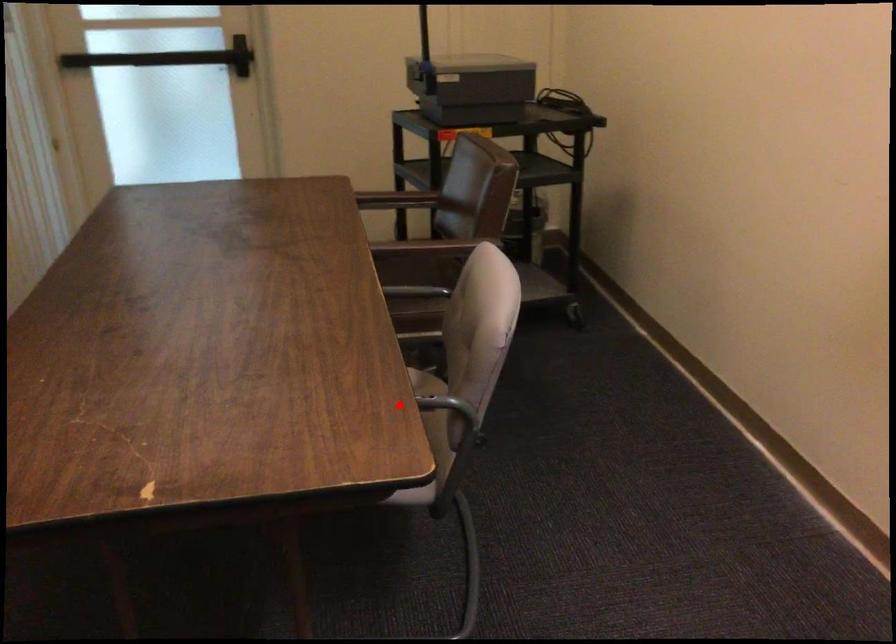
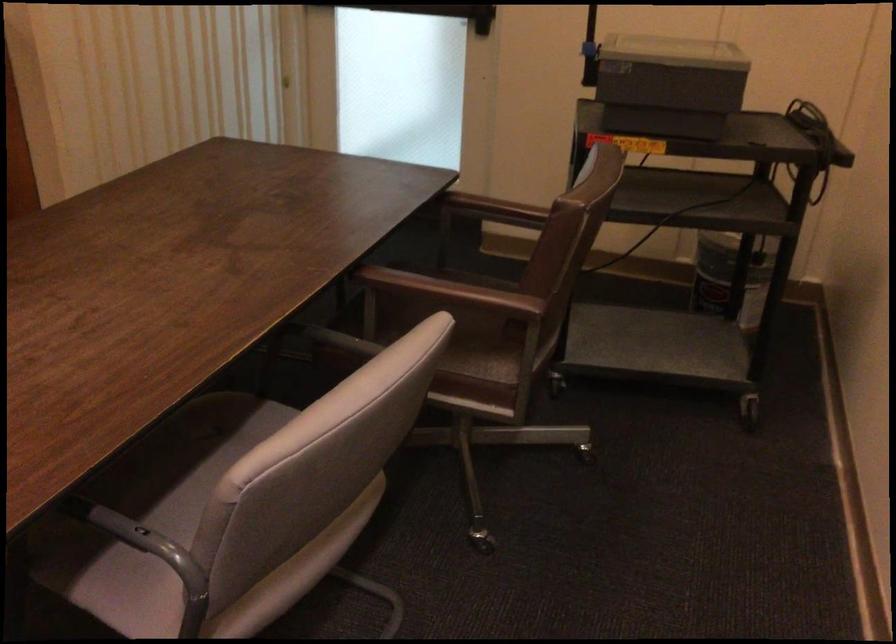
Question: A red point is marked in image1. In image2, is the corresponding 3D point closer to the camera or farther? Reply with the corresponding letter.

Choices:
 (A) The corresponding 3D point is closer.
 (B) The corresponding 3D point is farther.

Answer: (A)